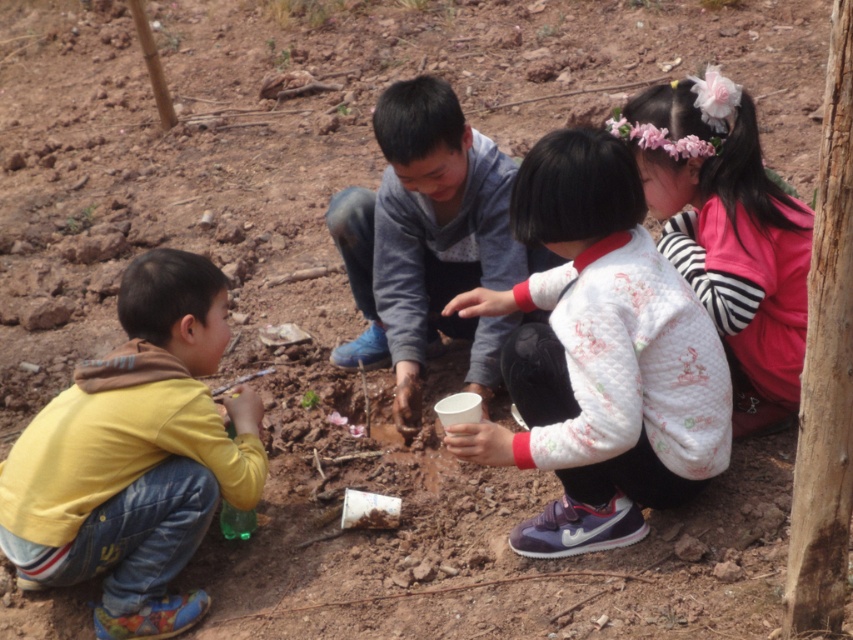
Question: Does yellow cotton shirt at lower left appear over dirty clay hands at center?

Choices:
 (A) no
 (B) yes

Answer: (A)

Question: Which object appears farthest from the camera in this image?

Choices:
 (A) dirty clay hands at center
 (B) white quilted sweater at center
 (C) yellow cotton shirt at lower left

Answer: (A)

Question: Does white quilted sweater at center appear on the left side of fluffy pink hairband at upper right?

Choices:
 (A) no
 (B) yes

Answer: (B)

Question: Which object is farther from the camera taking this photo?

Choices:
 (A) fluffy pink hairband at upper right
 (B) white quilted sweater at center
 (C) dirty clay hands at center

Answer: (C)

Question: Is white quilted sweater at center positioned before dirty clay hands at center?

Choices:
 (A) yes
 (B) no

Answer: (A)

Question: Which of the following is the farthest from the observer?

Choices:
 (A) (721, 272)
 (B) (663, 432)
 (C) (483, 150)
 (D) (6, 492)

Answer: (C)